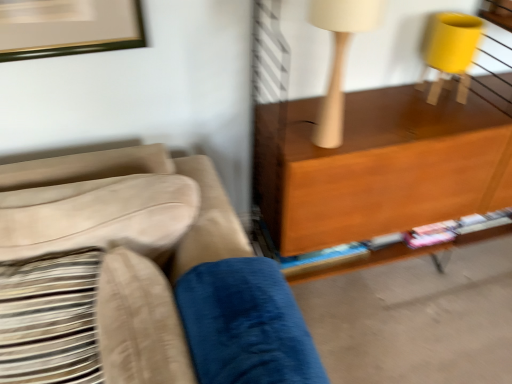
Question: From the image's perspective, is beige textured pillow at left, placed as the 2th pillow when sorted from right to left, positioned above or below suede beige couch at left?

Choices:
 (A) above
 (B) below

Answer: (A)

Question: Is point (24, 347) closer or farther from the camera than point (137, 329)?

Choices:
 (A) farther
 (B) closer

Answer: (A)

Question: Based on their relative distances, which object is nearer to the suede beige couch at left?

Choices:
 (A) velvety blue pillow at lower center, the 2th pillow positioned from the left
 (B) beige textured pillow at left, acting as the first pillow starting from the left
 (C) wooden shelf at right
 (D) white matte table lamp at upper right

Answer: (A)

Question: Which is nearer to the velvety blue pillow at lower center, the 2th pillow positioned from the left?

Choices:
 (A) white matte table lamp at upper right
 (B) suede beige couch at left
 (C) beige textured pillow at left, acting as the first pillow starting from the left
 (D) wooden shelf at right

Answer: (B)